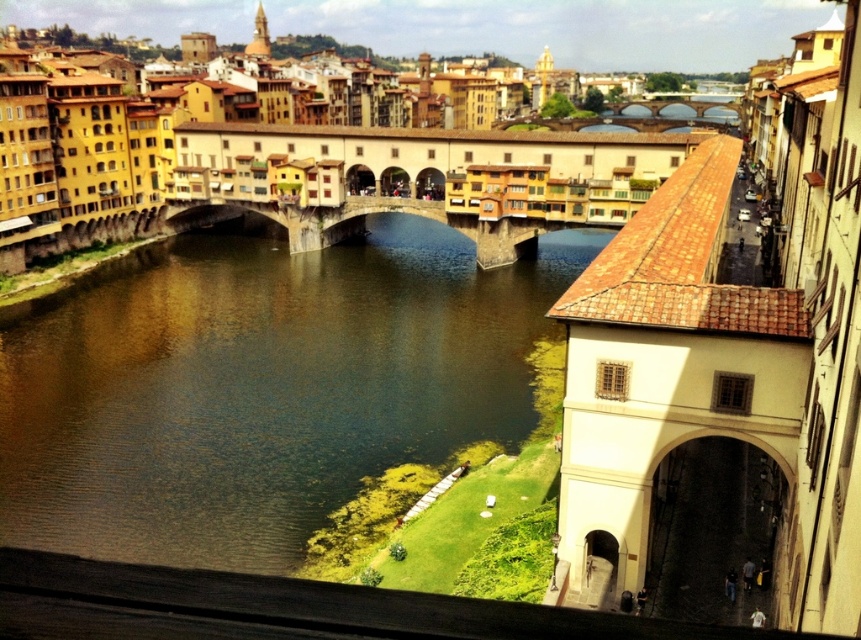
Measure the distance from brown water at center to stone bridge at center.

brown water at center is 89.16 feet from stone bridge at center.

Which of these two, brown water at center or stone bridge at center, stands shorter?

stone bridge at center

This screenshot has height=640, width=861. What are the coordinates of `brown water at center` in the screenshot? It's located at (259, 387).